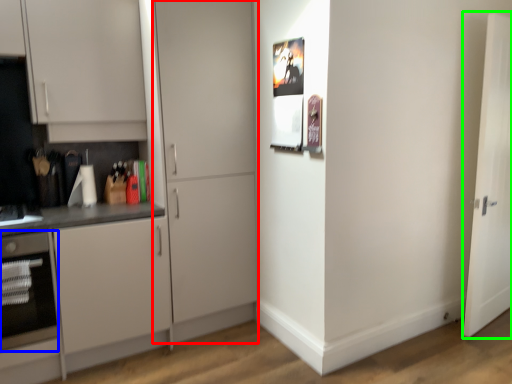
Question: Based on their relative distances, which object is farther from door (highlighted by a red box)? Choose from oven (highlighted by a blue box) and door (highlighted by a green box).

Choices:
 (A) oven
 (B) door

Answer: (B)